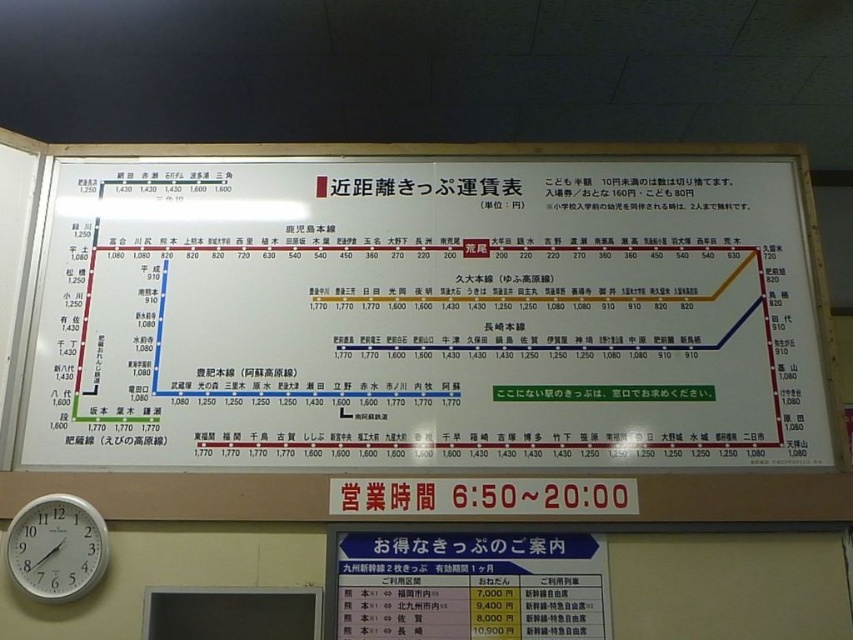
You are standing at the train station and need to check the fare for a short trip. You see a matte plastic signboard at center and a white plastic clock at lower left. Which object should you look at to find the fare information?

The matte plastic signboard at center is below the white plastic clock at lower left. Since the signboard is the fare chart, you should look at the matte plastic signboard at center to find the fare information.

You are at a train station and need to check the fare for a short trip. You see a matte plastic signboard at center and a white plastic clock at lower left. Which object should you look at to find the fare information?

The fare information is on the matte plastic signboard at center, which is wider than the white plastic clock at lower left.

Looking at this image, you are at a train station and need to check the fare for a short distance trip. You see a matte plastic signboard at center and a white plastic clock at lower left. Which object should you look at to find the fare information?

The matte plastic signboard at center is to the right of the white plastic clock at lower left, so you should look at the matte plastic signboard at center to find the fare information.